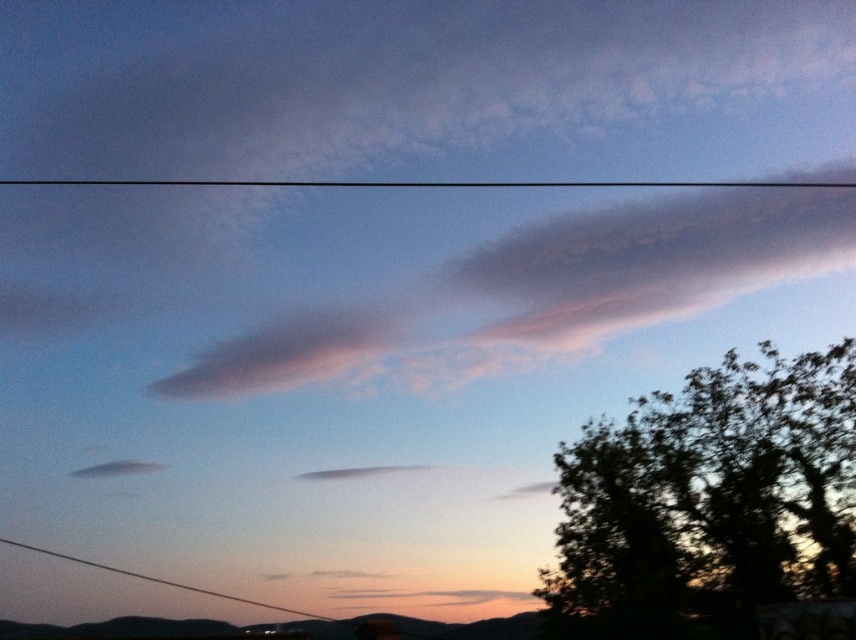
Is dark green leafy tree at right thinner than pinkish-gray cloud at upper center?

Indeed, dark green leafy tree at right has a lesser width compared to pinkish-gray cloud at upper center.

Is dark green leafy tree at right positioned at the back of pinkish-gray cloud at upper center?

No.

In order to click on dark green leafy tree at right in this screenshot , I will do `click(712, 508)`.

The image size is (856, 640). Describe the element at coordinates (556, 285) in the screenshot. I see `pinkish-gray cloud at upper center` at that location.

Does pinkish-gray cloud at upper center appear on the left side of black wire at lower center?

Incorrect, pinkish-gray cloud at upper center is not on the left side of black wire at lower center.

What do you see at coordinates (556, 285) in the screenshot? This screenshot has width=856, height=640. I see `pinkish-gray cloud at upper center` at bounding box center [556, 285].

Identify the location of pinkish-gray cloud at upper center. (556, 285).

Can you confirm if dark green leafy tree at right is shorter than black wire at lower center?

No.

Between dark green leafy tree at right and black wire at lower center, which one is positioned higher?

dark green leafy tree at right is higher up.

What do you see at coordinates (712, 508) in the screenshot? This screenshot has height=640, width=856. I see `dark green leafy tree at right` at bounding box center [712, 508].

At what (x,y) coordinates should I click in order to perform the action: click on dark green leafy tree at right. Please return your answer as a coordinate pair (x, y). The height and width of the screenshot is (640, 856). Looking at the image, I should click on (712, 508).